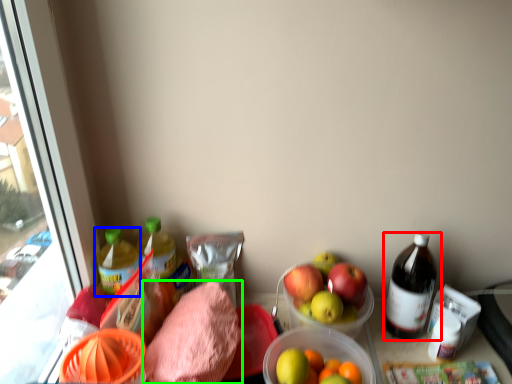
Question: Estimate the real-world distances between objects in this image. Which object is closer to bottle (highlighted by a red box), bottle (highlighted by a blue box) or waste (highlighted by a green box)?

Choices:
 (A) bottle
 (B) waste

Answer: (B)